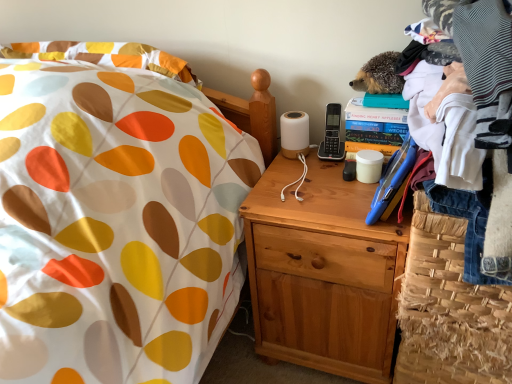
Question: Is point (420, 210) closer or farther from the camera than point (271, 319)?

Choices:
 (A) farther
 (B) closer

Answer: (B)

Question: In the image, is woven straw basket at lower right positioned in front of or behind natural wood nightstand at center?

Choices:
 (A) behind
 (B) front

Answer: (B)

Question: Estimate the real-world distances between objects in this image. Which object is farther from the woven straw basket at lower right?

Choices:
 (A) white cotton shirt at upper right
 (B) natural wood nightstand at center

Answer: (A)

Question: Which is farther from the white cotton shirt at upper right?

Choices:
 (A) natural wood nightstand at center
 (B) woven straw basket at lower right

Answer: (A)